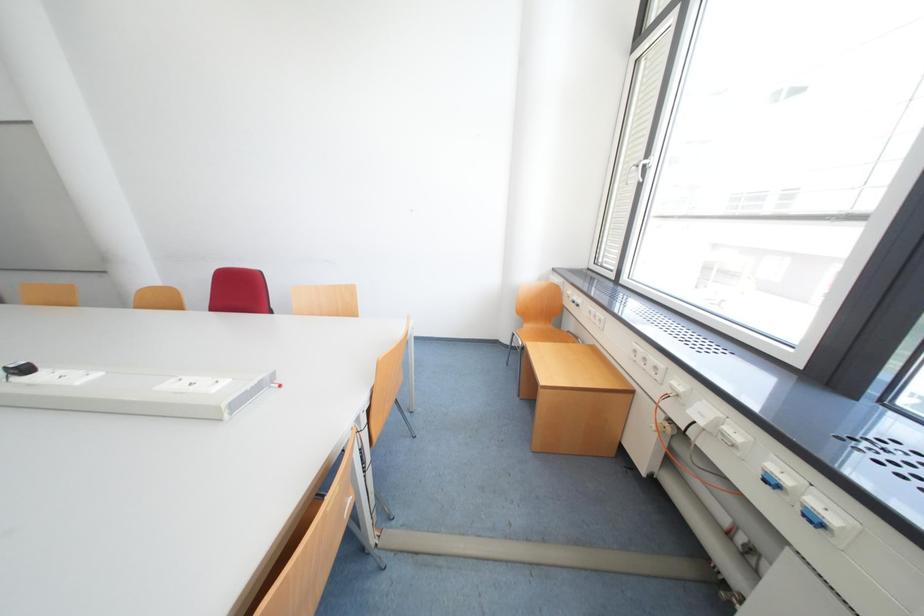
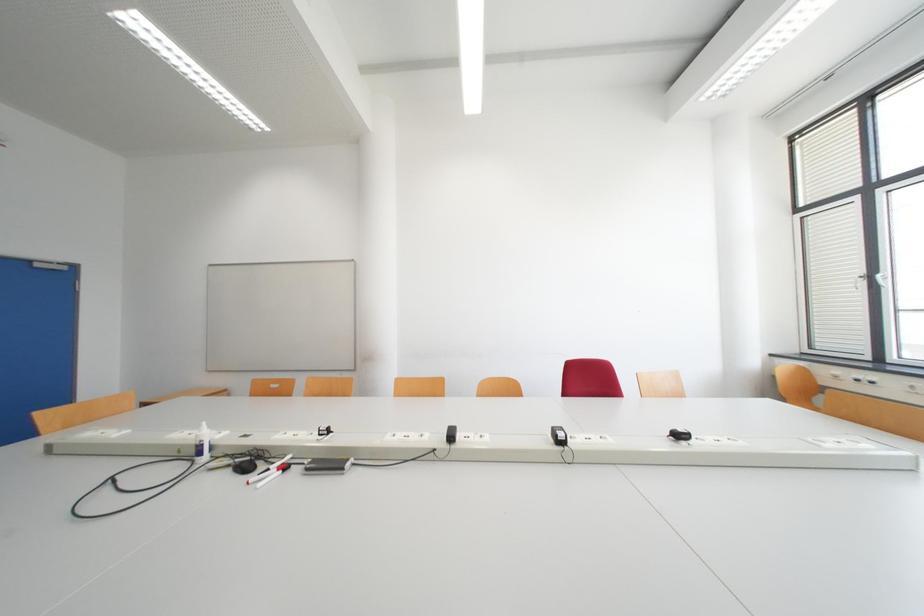
Question: In a continuous first-person perspective shot, in which direction is the camera moving?

Choices:
 (A) Left
 (B) Right
 (C) Forward
 (D) Backward

Answer: (A)